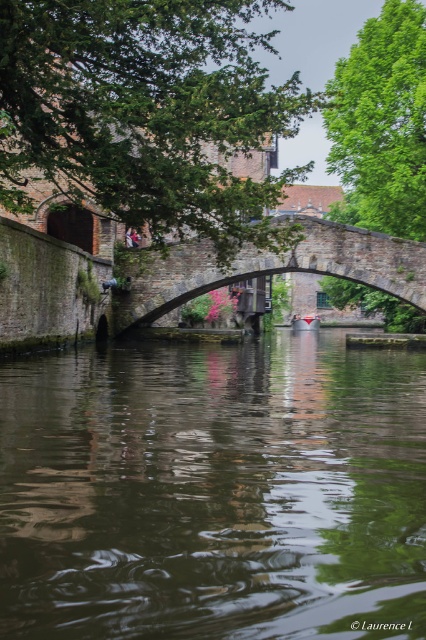
Can you confirm if stone arch bridge at center is positioned to the left of matte red boat at center?

Indeed, stone arch bridge at center is positioned on the left side of matte red boat at center.

Which is above, stone arch bridge at center or matte red boat at center?

stone arch bridge at center is above.

Does point (276, 259) come farther from viewer compared to point (316, 316)?

That is False.

Where is `stone arch bridge at center`? This screenshot has height=640, width=426. stone arch bridge at center is located at coordinates (264, 268).

Is green reflective water at center above matte red boat at center?

No.

Who is lower down, green reflective water at center or matte red boat at center?

green reflective water at center is below.

Is point (333, 458) behind point (299, 326)?

That is False.

Identify the location of green reflective water at center. This screenshot has height=640, width=426. (213, 492).

Looking at this image, which is below, green reflective water at center or stone arch bridge at center?

green reflective water at center

Does green reflective water at center have a smaller size compared to stone arch bridge at center?

Yes, green reflective water at center is smaller than stone arch bridge at center.

Is point (189, 362) farther from viewer compared to point (389, 275)?

No, (189, 362) is closer to viewer.

Find the location of a particular element. green reflective water at center is located at coordinates (213, 492).